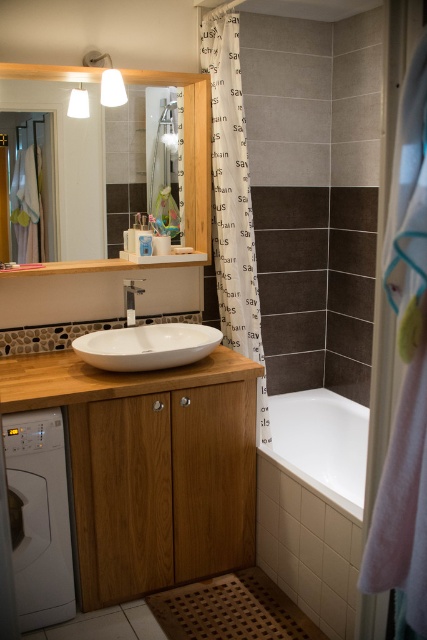
In the scene shown: Does white wood vanity at center have a greater width compared to white glossy sink at center?

Indeed, white wood vanity at center has a greater width compared to white glossy sink at center.

Measure the distance from white wood vanity at center to white glossy sink at center.

A distance of 33.62 centimeters exists between white wood vanity at center and white glossy sink at center.

This screenshot has width=427, height=640. What do you see at coordinates (151, 467) in the screenshot?
I see `white wood vanity at center` at bounding box center [151, 467].

At what (x,y) coordinates should I click in order to perform the action: click on white wood vanity at center. Please return your answer as a coordinate pair (x, y). The image size is (427, 640). Looking at the image, I should click on (151, 467).

Is point (98, 241) positioned in front of point (111, 356)?

No, (98, 241) is behind (111, 356).

Between white glossy mirror at upper center and white glossy sink at center, which one appears on the left side from the viewer's perspective?

white glossy mirror at upper center

At what (x,y) coordinates should I click in order to perform the action: click on white glossy mirror at upper center. Please return your answer as a coordinate pair (x, y). Looking at the image, I should click on (64, 147).

Identify the location of white glossy mirror at upper center. Image resolution: width=427 pixels, height=640 pixels. (64, 147).

From the picture: Is pink fabric towel at right taller than white glossy mirror at upper center?

Correct, pink fabric towel at right is much taller as white glossy mirror at upper center.

Is point (409, 580) closer to viewer compared to point (76, 164)?

Yes.

The image size is (427, 640). What do you see at coordinates (406, 372) in the screenshot?
I see `pink fabric towel at right` at bounding box center [406, 372].

Locate an element on the screen. pink fabric towel at right is located at coordinates (406, 372).